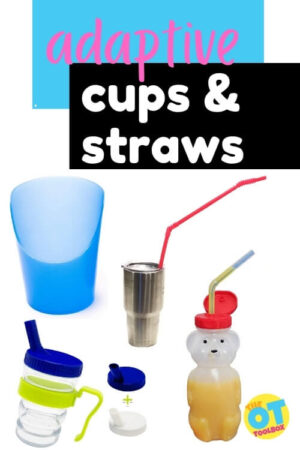
Find the location of `cups`. cups is located at coordinates (76, 244), (54, 356), (140, 395), (204, 395), (149, 300).